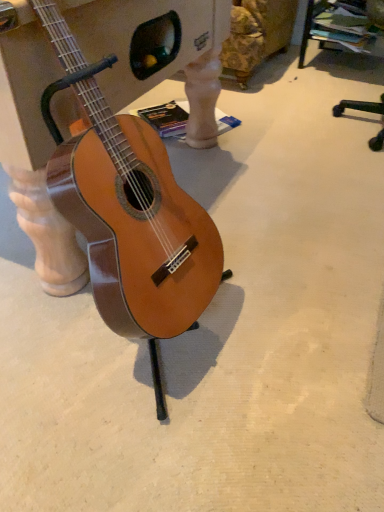
What do you see at coordinates (127, 207) in the screenshot?
I see `natural wood guitar at center` at bounding box center [127, 207].

You are a GUI agent. You are given a task and a screenshot of the screen. Output one action in this format:
    pyautogui.click(x=<x>, y=<y>)
    Task: Click on the natural wood guitar at center
    The height and width of the screenshot is (512, 384).
    Given the screenshot: What is the action you would take?
    pyautogui.click(x=127, y=207)

What is the approximate width of natural wood guitar at center?

natural wood guitar at center is 16.10 inches in width.

Locate an element on the screen. The height and width of the screenshot is (512, 384). natural wood guitar at center is located at coordinates (127, 207).